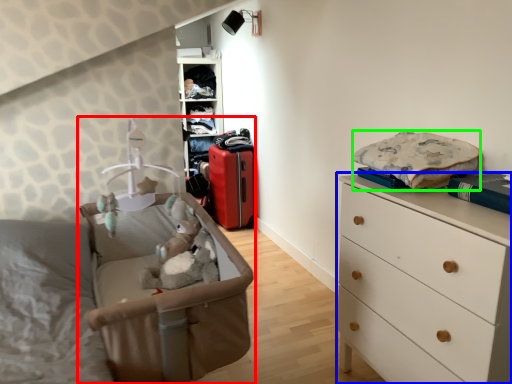
Question: Which is farther away from infant bed (highlighted by a red box)? chest of drawers (highlighted by a blue box) or clothing (highlighted by a green box)?

Choices:
 (A) chest of drawers
 (B) clothing

Answer: (B)